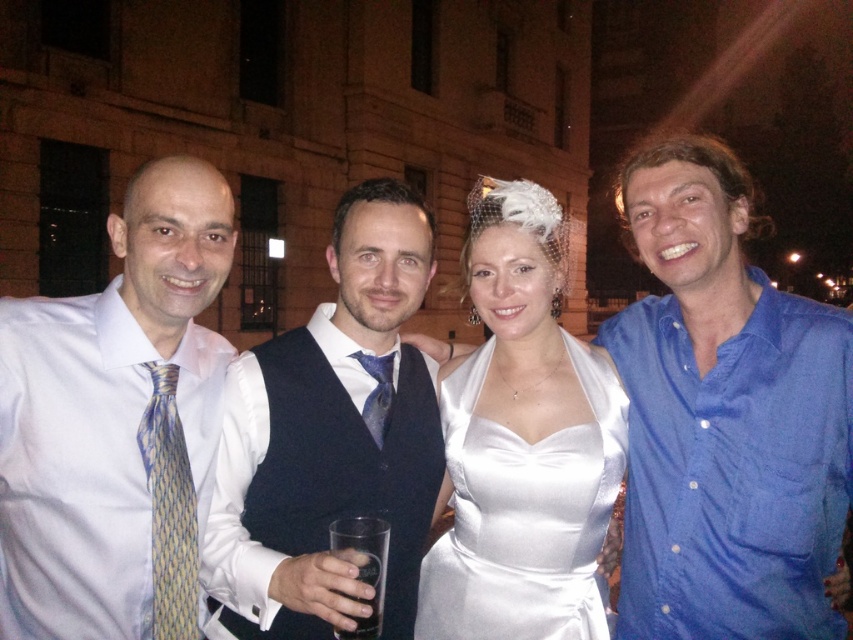
Question: Which point is farther from the camera taking this photo?

Choices:
 (A) (392, 378)
 (B) (254, 486)

Answer: (A)

Question: Which of the following is the farthest from the observer?

Choices:
 (A) white silk shirt and tie at left
 (B) yellowtextured fabrictie at left
 (C) matte blue vest at center
 (D) clear glass at center

Answer: (B)

Question: From the image, what is the correct spatial relationship of blue cotton shirt at right in relation to clear glass at center?

Choices:
 (A) below
 (B) above

Answer: (B)

Question: Which point appears closest to the camera in this image?

Choices:
 (A) (227, 490)
 (B) (531, 572)

Answer: (A)

Question: Does blue cotton shirt at right have a larger size compared to blue satin tie at center?

Choices:
 (A) yes
 (B) no

Answer: (A)

Question: Does satin white dress at center lie in front of clear glass at center?

Choices:
 (A) yes
 (B) no

Answer: (B)